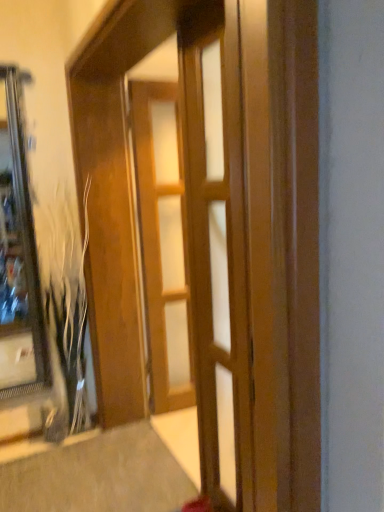
What is the approximate height of wooden door at center, which ranks as the 1th door in back-to-front order?

wooden door at center, which ranks as the 1th door in back-to-front order, is 6.63 feet in height.

I want to click on wooden door at center, which appears as the 2th door when viewed from the back, so click(217, 248).

Identify the location of wooden barn door at center. (158, 224).

Considering the sizes of objects wooden barn door at center and wooden door at center, which appears as the 1th door when viewed from the front, in the image provided, who is shorter, wooden barn door at center or wooden door at center, which appears as the 1th door when viewed from the front,?

Answer: wooden door at center, which appears as the 1th door when viewed from the front.

From the image's perspective, starting from the wooden barn door at center, which door is the 1st one above? Please provide its 2D coordinates.

[(217, 248)]

Looking at this image, can you confirm if wooden barn door at center is thinner than wooden door at center, which appears as the 2th door when viewed from the back?

In fact, wooden barn door at center might be wider than wooden door at center, which appears as the 2th door when viewed from the back.

How many degrees apart are the facing directions of wooden door at center, which appears as the 1th door when viewed from the front, and wooden door at center, which is the 2th door from front to back?

84.4 degrees separate the facing orientations of wooden door at center, which appears as the 1th door when viewed from the front, and wooden door at center, which is the 2th door from front to back.

Where is `door on the right of wooden door at center, which ranks as the 1th door in back-to-front order`? The height and width of the screenshot is (512, 384). door on the right of wooden door at center, which ranks as the 1th door in back-to-front order is located at coordinates (217, 248).

Are wooden door at center, which appears as the 1th door when viewed from the front, and wooden door at center, which ranks as the 1th door in back-to-front order, located far from each other?

Yes, wooden door at center, which appears as the 1th door when viewed from the front, is far from wooden door at center, which ranks as the 1th door in back-to-front order.

In the image, is wooden door at center, which appears as the 2th door when viewed from the back, on the left side or the right side of wooden door at center, which ranks as the 1th door in back-to-front order?

Clearly, wooden door at center, which appears as the 2th door when viewed from the back, is on the right of wooden door at center, which ranks as the 1th door in back-to-front order, in the image.

Is wooden door at center, which appears as the 1th door when viewed from the front, outside of wooden barn door at center?

Yes, wooden door at center, which appears as the 1th door when viewed from the front, is outside of wooden barn door at center.

From the image's perspective, is wooden door at center, which appears as the 1th door when viewed from the front, located above or below wooden barn door at center?

wooden door at center, which appears as the 1th door when viewed from the front, is above wooden barn door at center.

Looking at this image, is the position of wooden door at center, which appears as the 2th door when viewed from the back, more distant than that of wooden barn door at center?

Yes, wooden door at center, which appears as the 2th door when viewed from the back, is behind wooden barn door at center.

Is wooden door at center, which appears as the 2th door when viewed from the back, in contact with wooden barn door at center?

No, wooden door at center, which appears as the 2th door when viewed from the back, is not with wooden barn door at center.

Is wooden door at center, which is the 2th door from front to back, oriented towards wooden barn door at center?

No, wooden door at center, which is the 2th door from front to back, is not aimed at wooden barn door at center.

Is wooden door at center, which is the 2th door from front to back, wider or thinner than wooden barn door at center?

Clearly, wooden door at center, which is the 2th door from front to back, has less width compared to wooden barn door at center.

Is wooden door at center, which is the 2th door from front to back, positioned beyond the bounds of wooden barn door at center?

Indeed, wooden door at center, which is the 2th door from front to back, is completely outside wooden barn door at center.

Are wooden door at center, which is the 2th door from front to back, and wooden barn door at center beside each other?

No, wooden door at center, which is the 2th door from front to back, is not making contact with wooden barn door at center.

Locate an element on the screen. Image resolution: width=384 pixels, height=512 pixels. barn door lying in front of the wooden door at center, which ranks as the 1th door in back-to-front order is located at coordinates (158, 224).

From their relative heights in the image, would you say wooden barn door at center is taller or shorter than wooden door at center, which is the 2th door from front to back?

Considering their sizes, wooden barn door at center has more height than wooden door at center, which is the 2th door from front to back.

Is wooden barn door at center far from wooden door at center, which is the 2th door from front to back?

No, there isn't a large distance between wooden barn door at center and wooden door at center, which is the 2th door from front to back.

Which of these two, wooden barn door at center or wooden door at center, which ranks as the 1th door in back-to-front order, is thinner?

With smaller width is wooden door at center, which ranks as the 1th door in back-to-front order.

Is wooden door at center, which is the 2th door from front to back, further to camera compared to wooden door at center, which appears as the 1th door when viewed from the front?

Yes.

Consider the image. Could wooden door at center, which appears as the 1th door when viewed from the front, be considered to be inside wooden door at center, which is the 2th door from front to back?

No, wooden door at center, which is the 2th door from front to back, does not contain wooden door at center, which appears as the 1th door when viewed from the front.

Who is taller, wooden door at center, which ranks as the 1th door in back-to-front order, or wooden door at center, which appears as the 2th door when viewed from the back?

wooden door at center, which ranks as the 1th door in back-to-front order.

Who is smaller, wooden door at center, which ranks as the 1th door in back-to-front order, or wooden door at center, which appears as the 2th door when viewed from the back?

Smaller between the two is wooden door at center, which appears as the 2th door when viewed from the back.

Identify the location of barn door below the wooden door at center, which appears as the 2th door when viewed from the back (from the image's perspective). (158, 224).

Where is `door that appears on the left of wooden door at center, which appears as the 1th door when viewed from the front`? This screenshot has width=384, height=512. door that appears on the left of wooden door at center, which appears as the 1th door when viewed from the front is located at coordinates (162, 234).

Which object lies nearer to the anchor point wooden door at center, which ranks as the 1th door in back-to-front order, wooden barn door at center or wooden door at center, which appears as the 1th door when viewed from the front?

wooden barn door at center is positioned closer to the anchor wooden door at center, which ranks as the 1th door in back-to-front order.

Looking at the image, which one is located further to wooden door at center, which is the 2th door from front to back, wooden door at center, which appears as the 2th door when viewed from the back, or wooden barn door at center?

wooden door at center, which appears as the 2th door when viewed from the back, lies further to wooden door at center, which is the 2th door from front to back, than the other object.

From the image, which object appears to be farther from wooden door at center, which appears as the 2th door when viewed from the back, wooden barn door at center or wooden door at center, which is the 2th door from front to back?

wooden door at center, which is the 2th door from front to back, lies further to wooden door at center, which appears as the 2th door when viewed from the back, than the other object.

From the image, which object appears to be nearer to wooden barn door at center, wooden door at center, which appears as the 2th door when viewed from the back, or wooden door at center, which ranks as the 1th door in back-to-front order?

Based on the image, wooden door at center, which appears as the 2th door when viewed from the back, appears to be nearer to wooden barn door at center.

Based on their spatial positions, is wooden door at center, which is the 2th door from front to back, or wooden barn door at center further from wooden door at center, which appears as the 2th door when viewed from the back?

wooden door at center, which is the 2th door from front to back, lies further to wooden door at center, which appears as the 2th door when viewed from the back, than the other object.

Estimate the real-world distances between objects in this image. Which object is closer to wooden barn door at center, wooden door at center, which ranks as the 1th door in back-to-front order, or wooden door at center, which appears as the 2th door when viewed from the back?

Based on the image, wooden door at center, which appears as the 2th door when viewed from the back, appears to be nearer to wooden barn door at center.

Find the location of a particular element. The image size is (384, 512). door located between wooden barn door at center and wooden door at center, which is the 2th door from front to back, in the depth direction is located at coordinates (217, 248).